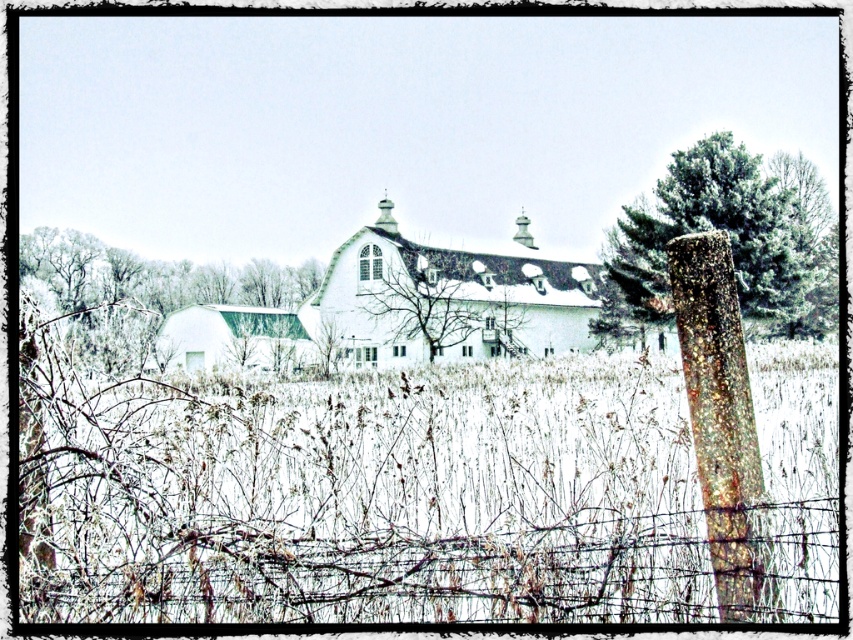
Is green matte barn at left to the left of bare branches at center from the viewer's perspective?

Yes, green matte barn at left is to the left of bare branches at center.

Identify the location of green matte barn at left. (169, 305).

Where is `green matte barn at left`? green matte barn at left is located at coordinates (x=169, y=305).

Which is more to the right, barbed wire fence at lower center or green matte barn at left?

Positioned to the right is barbed wire fence at lower center.

Which of these two, barbed wire fence at lower center or green matte barn at left, stands taller?

green matte barn at left

Measure the distance between point (39, 582) and camera.

The distance of point (39, 582) from camera is 4.45 meters.

Locate an element on the screen. The image size is (853, 640). barbed wire fence at lower center is located at coordinates point(456,572).

Does green textured pine at right have a lesser width compared to bare branches at center?

No, green textured pine at right is not thinner than bare branches at center.

Who is shorter, green textured pine at right or bare branches at center?

bare branches at center is shorter.

This screenshot has width=853, height=640. In order to click on green textured pine at right in this screenshot , I will do [x=730, y=237].